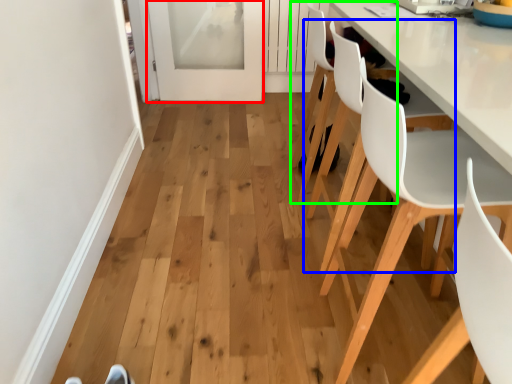
Question: Which object is positioned farthest from screen door (highlighted by a red box)? Select from chair (highlighted by a blue box) and chair (highlighted by a green box).

Choices:
 (A) chair
 (B) chair

Answer: (A)